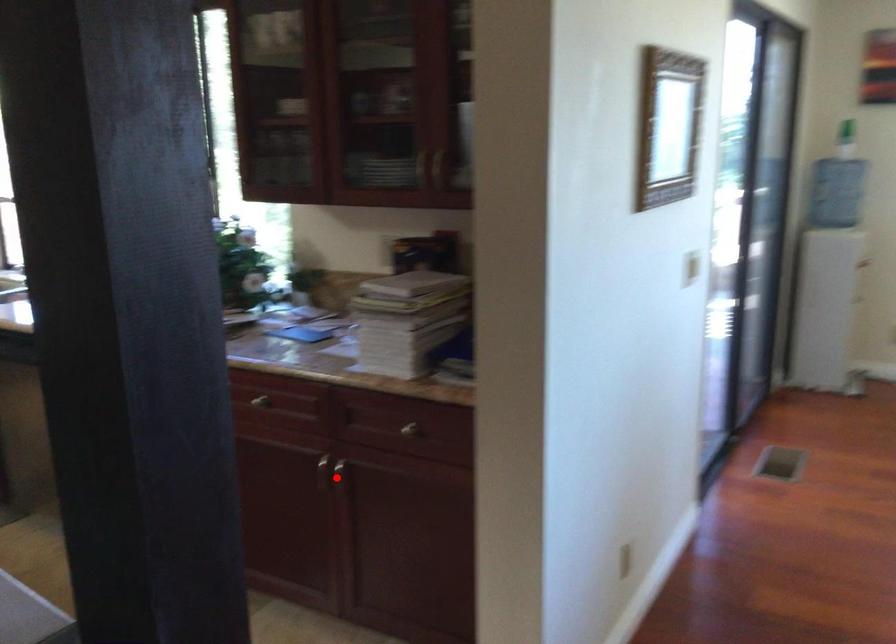
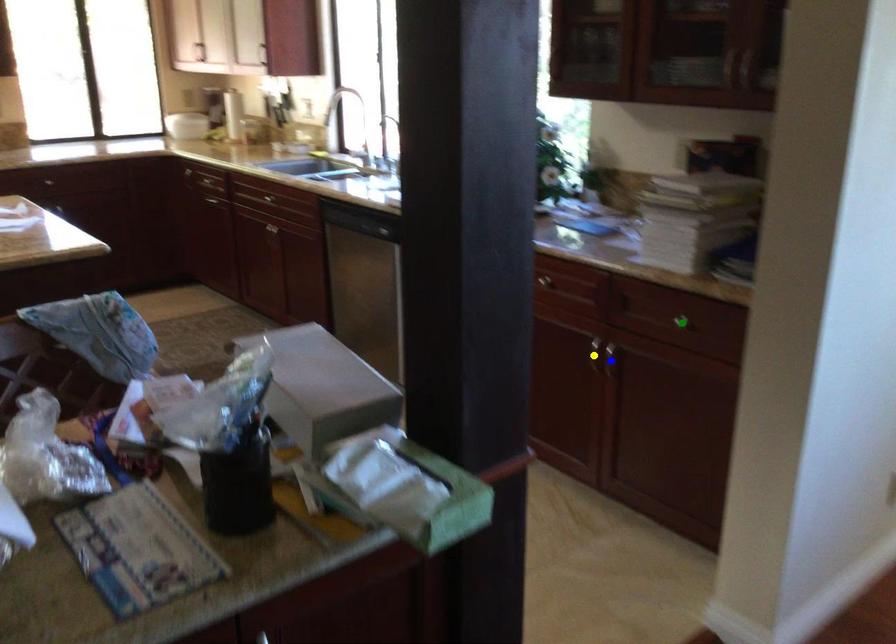
Question: I am providing you with two images of the same scene from different viewpoints. A red point is marked on the first image. You are given multiple points on the second image. Which point in image 2 represents the same 3d spot as the red point in image 1?

Choices:
 (A) yellow point
 (B) green point
 (C) blue point

Answer: (C)